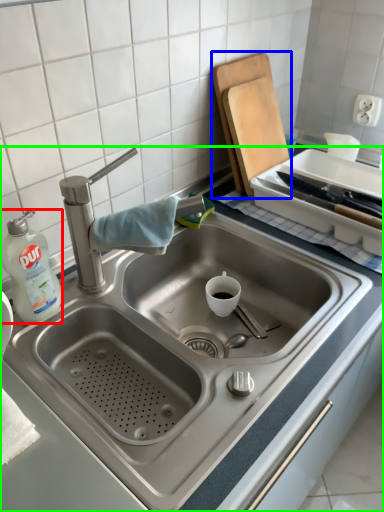
Question: Considering the real-world distances, which object is farthest from cleaning product (highlighted by a red box)? cutting board (highlighted by a blue box) or sink (highlighted by a green box)?

Choices:
 (A) cutting board
 (B) sink

Answer: (A)